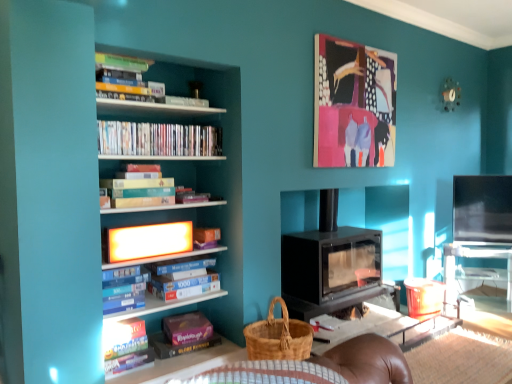
Question: Is hardcover books at center, the fourth book positioned from the bottom, completely or partially inside woven brown basket at lower center?

Choices:
 (A) yes
 (B) no

Answer: (B)

Question: Does woven brown basket at lower center have a larger size compared to hardcover books at center, which ranks as the second book in top-to-bottom order?

Choices:
 (A) yes
 (B) no

Answer: (A)

Question: From a real-world perspective, is woven brown basket at lower center located higher than hardcover books at center, the fourth book positioned from the bottom?

Choices:
 (A) no
 (B) yes

Answer: (A)

Question: Does woven brown basket at lower center turn towards hardcover books at center, the fourth book positioned from the bottom?

Choices:
 (A) yes
 (B) no

Answer: (B)

Question: Does woven brown basket at lower center have a smaller size compared to hardcover books at center, which ranks as the second book in top-to-bottom order?

Choices:
 (A) no
 (B) yes

Answer: (A)

Question: Does woven brown basket at lower center appear on the left side of hardcover books at center, the fourth book positioned from the bottom?

Choices:
 (A) yes
 (B) no

Answer: (B)

Question: Can you confirm if hardcover books at center, the fourth book positioned from the bottom, is shorter than woven brown basket at lower center?

Choices:
 (A) no
 (B) yes

Answer: (B)

Question: Is hardcover books at center, which ranks as the second book in top-to-bottom order, oriented away from woven brown basket at lower center?

Choices:
 (A) yes
 (B) no

Answer: (B)

Question: From the image's perspective, would you say hardcover books at center, which ranks as the second book in top-to-bottom order, is shown under woven brown basket at lower center?

Choices:
 (A) no
 (B) yes

Answer: (A)

Question: Is hardcover books at center, which ranks as the second book in top-to-bottom order, thinner than woven brown basket at lower center?

Choices:
 (A) yes
 (B) no

Answer: (A)

Question: Considering the relative positions of hardcover books at center, the fourth book positioned from the bottom, and woven brown basket at lower center in the image provided, is hardcover books at center, the fourth book positioned from the bottom, to the left of woven brown basket at lower center from the viewer's perspective?

Choices:
 (A) no
 (B) yes

Answer: (B)

Question: From a real-world perspective, is hardcover books at center, the fourth book positioned from the bottom, below woven brown basket at lower center?

Choices:
 (A) no
 (B) yes

Answer: (A)

Question: Does woven brown basket at lower center have a lesser width compared to bright orange plastic shelf at upper center?

Choices:
 (A) yes
 (B) no

Answer: (B)